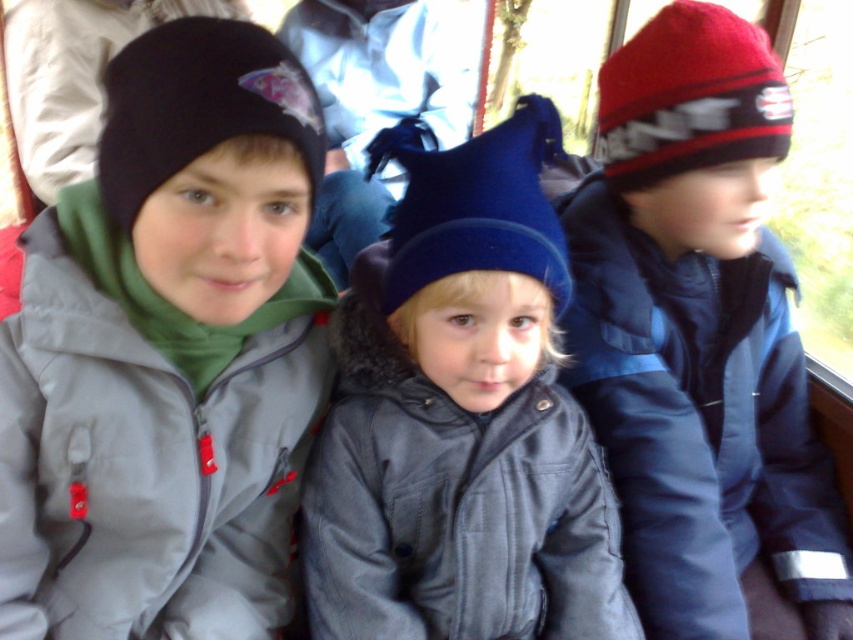
Between matte gray jacket at left and velvet blue hat at center, which one is positioned higher?

matte gray jacket at left is higher up.

Does matte gray jacket at left come in front of velvet blue hat at center?

Yes, it is.

Who is more forward, (x=245, y=564) or (x=440, y=593)?

Point (x=440, y=593) is in front.

This screenshot has height=640, width=853. What are the coordinates of `matte gray jacket at left` in the screenshot? It's located at (167, 353).

Measure the distance between point (697, 221) and camera.

A distance of 1.05 meters exists between point (697, 221) and camera.

Where is `red knit hat at right`? red knit hat at right is located at coordinates (701, 340).

Does matte gray jacket at left lie in front of red knit hat at right?

Yes, it is.

Is matte gray jacket at left taller than red knit hat at right?

In fact, matte gray jacket at left may be shorter than red knit hat at right.

Identify the location of matte gray jacket at left. (167, 353).